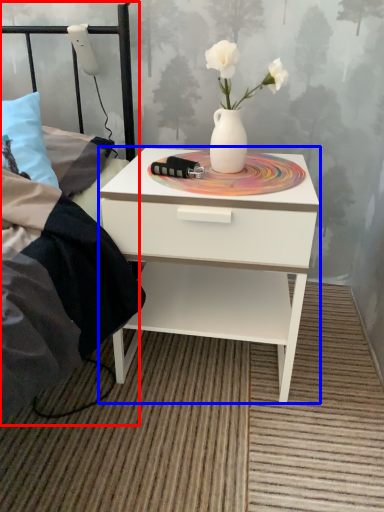
Question: Which object is closer to the camera taking this photo, bed frame (highlighted by a red box) or nightstand (highlighted by a blue box)?

Choices:
 (A) bed frame
 (B) nightstand

Answer: (A)